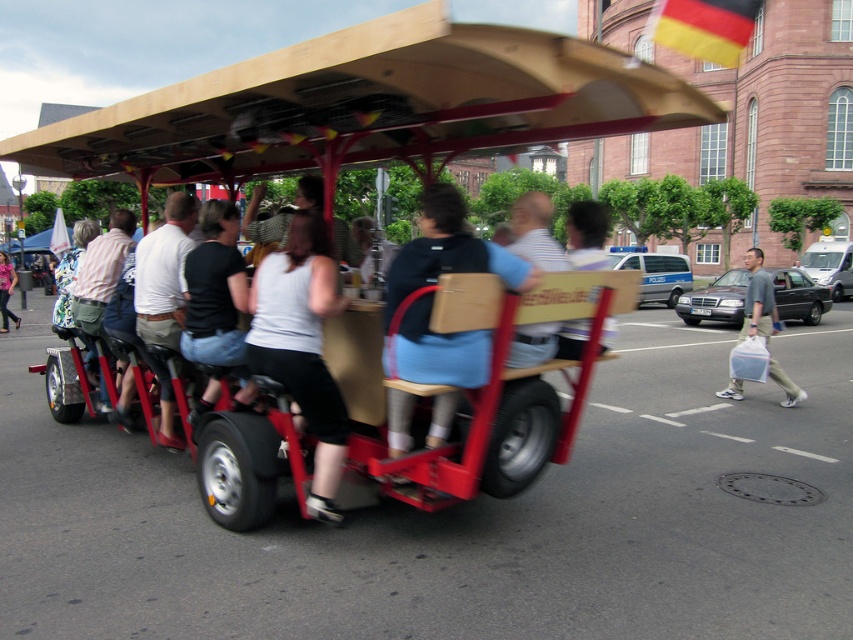
You are a passenger in the light blue denim jacket at center of the pedal powered bus. You want to wave to someone on the sidewalk using the yellow fabric flag at upper right. Can you reach it from your seat?

The yellow fabric flag at upper right is located above the light blue denim jacket at center, so it is positioned higher than your seat. You might need to stand up or ask someone nearby to help you reach it.

You are a photographer standing in front of the pedal powered bus. You want to take a photo of the yellow fabric flag at upper right and the light blue denim jacket at center. Which object is taller in the photo?

The yellow fabric flag at upper right is taller than the light blue denim jacket at center.

Where is the metallic red golf cart at center located in the image?

The metallic red golf cart at center is located at point (370, 106) in the image.